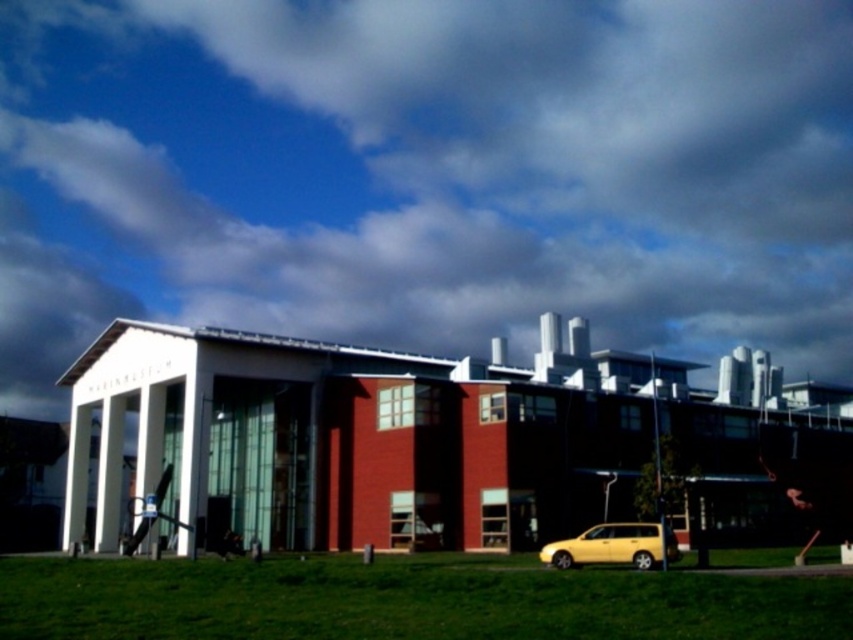
What do you see at coordinates (427, 173) in the screenshot? I see `cloudy sky at upper center` at bounding box center [427, 173].

Between cloudy sky at upper center and green grass at lower center, which one is positioned lower?

green grass at lower center is lower down.

Is point (793, 280) closer to camera compared to point (682, 618)?

No, (793, 280) is further to viewer.

The width and height of the screenshot is (853, 640). Identify the location of cloudy sky at upper center. (427, 173).

Consider the image. Is cloudy sky at upper center taller than white glass building at center?

Indeed, cloudy sky at upper center has a greater height compared to white glass building at center.

Can you confirm if cloudy sky at upper center is positioned above white glass building at center?

Yes.

Identify the location of cloudy sky at upper center. The width and height of the screenshot is (853, 640). (427, 173).

Locate an element on the screen. The width and height of the screenshot is (853, 640). cloudy sky at upper center is located at coordinates (427, 173).

Between white glass building at center and yellow matte car at lower right, which one has more height?

white glass building at center

Who is more forward, [384,476] or [599,547]?

Point [599,547] is in front.

The image size is (853, 640). Identify the location of white glass building at center. (405, 433).